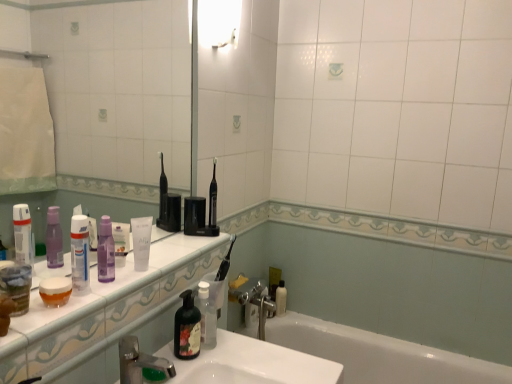
Image resolution: width=512 pixels, height=384 pixels. I want to click on free space in front of transparent plastic bottle at left, which is counted as the 1th toiletry, starting from the left, so click(x=52, y=317).